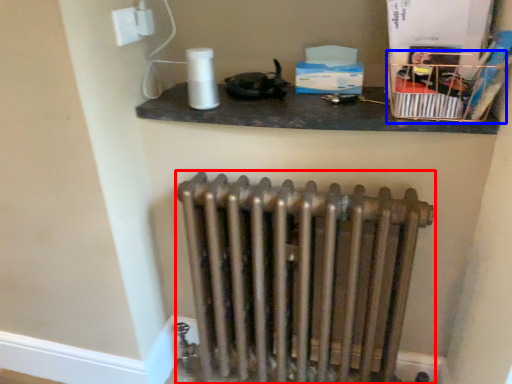
Question: Which object is closer to the camera taking this photo, radiator (highlighted by a red box) or crate (highlighted by a blue box)?

Choices:
 (A) radiator
 (B) crate

Answer: (B)